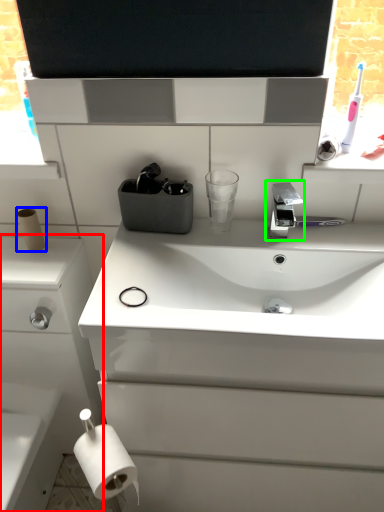
Question: Which object is the closest to the bathroom cabinet (highlighted by a red box)? Choose among these: toilet paper (highlighted by a blue box) or tap (highlighted by a green box).

Choices:
 (A) toilet paper
 (B) tap

Answer: (A)